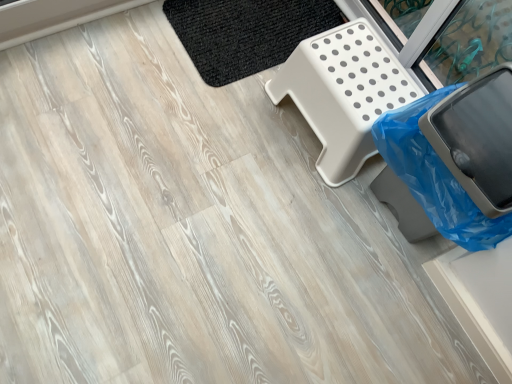
Question: From the image's perspective, is black woven mat at upper center located beneath white plastic step stool at upper right?

Choices:
 (A) no
 (B) yes

Answer: (A)

Question: From the image's perspective, is black woven mat at upper center on white plastic step stool at upper right?

Choices:
 (A) yes
 (B) no

Answer: (A)

Question: Considering the relative sizes of black woven mat at upper center and white plastic step stool at upper right in the image provided, is black woven mat at upper center taller than white plastic step stool at upper right?

Choices:
 (A) yes
 (B) no

Answer: (B)

Question: Can you confirm if black woven mat at upper center is thinner than white plastic step stool at upper right?

Choices:
 (A) yes
 (B) no

Answer: (B)

Question: Is white plastic step stool at upper right located within black woven mat at upper center?

Choices:
 (A) yes
 (B) no

Answer: (B)

Question: Is black woven mat at upper center further to the viewer compared to white plastic step stool at upper right?

Choices:
 (A) yes
 (B) no

Answer: (A)

Question: Is blue plastic trash can at lower right in front of black woven mat at upper center?

Choices:
 (A) yes
 (B) no

Answer: (A)

Question: Would you say blue plastic trash can at lower right is outside black woven mat at upper center?

Choices:
 (A) no
 (B) yes

Answer: (B)

Question: From the image's perspective, would you say blue plastic trash can at lower right is positioned over black woven mat at upper center?

Choices:
 (A) yes
 (B) no

Answer: (B)

Question: Can black woven mat at upper center be found inside blue plastic trash can at lower right?

Choices:
 (A) yes
 (B) no

Answer: (B)

Question: Is the position of blue plastic trash can at lower right more distant than that of black woven mat at upper center?

Choices:
 (A) yes
 (B) no

Answer: (B)

Question: Considering the relative sizes of blue plastic trash can at lower right and black woven mat at upper center in the image provided, is blue plastic trash can at lower right taller than black woven mat at upper center?

Choices:
 (A) yes
 (B) no

Answer: (A)

Question: Is black woven mat at upper center positioned before blue plastic trash can at lower right?

Choices:
 (A) no
 (B) yes

Answer: (A)